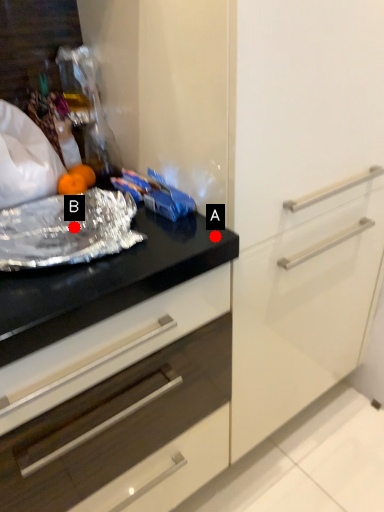
Question: Two points are circled on the image, labeled by A and B beside each circle. Which point is farther from the camera taking this photo?

Choices:
 (A) A is further
 (B) B is further

Answer: (B)